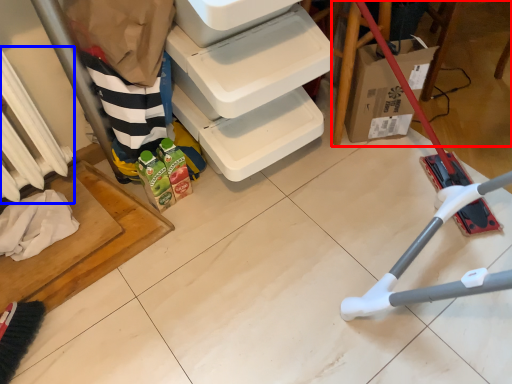
Question: Which object appears farthest to the camera in this image, furniture (highlighted by a red box) or radiator (highlighted by a blue box)?

Choices:
 (A) furniture
 (B) radiator

Answer: (A)